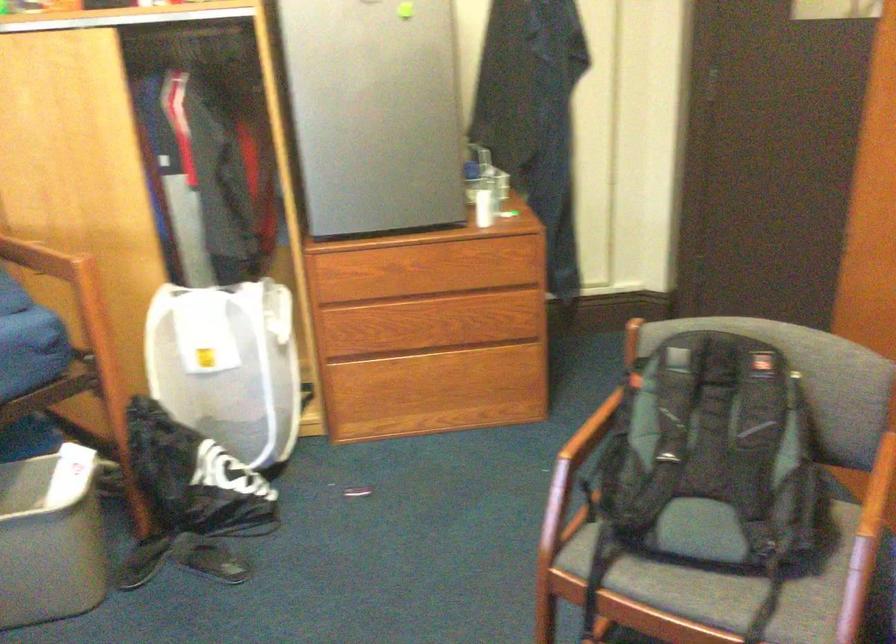
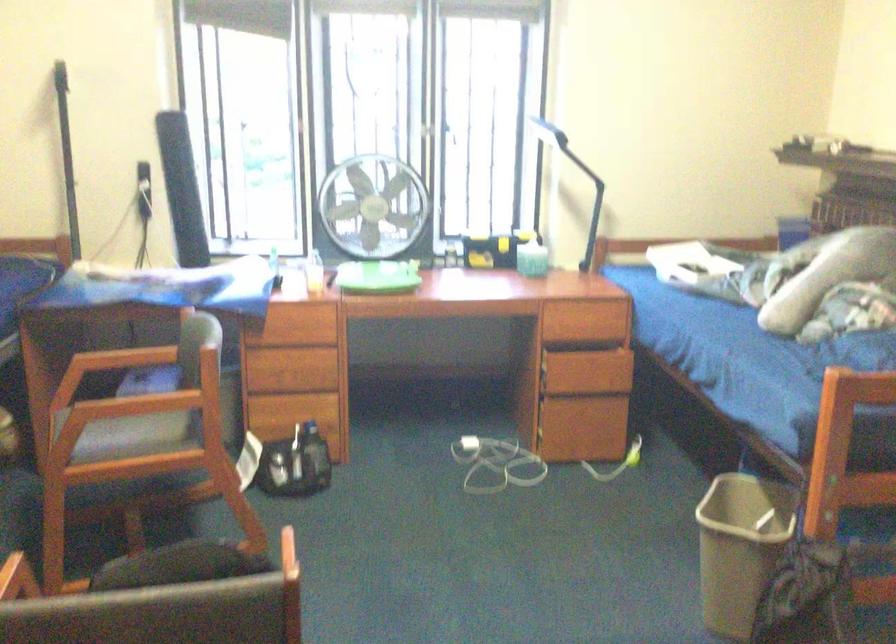
Find the pixel in the second image that matches (x=83, y=505) in the first image.

(741, 547)